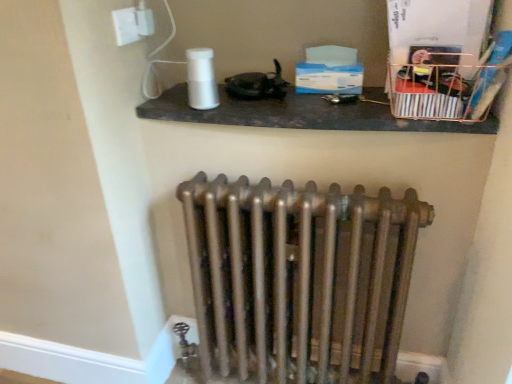
Question: Is white glossy shelf at upper center inside or outside of metallic wire basket at upper right?

Choices:
 (A) outside
 (B) inside

Answer: (A)

Question: In the image, is white glossy shelf at upper center on the left side or the right side of metallic wire basket at upper right?

Choices:
 (A) left
 (B) right

Answer: (A)

Question: Estimate the real-world distances between objects in this image. Which object is closer to the white glossy electric outlet at upper left?

Choices:
 (A) white glossy shelf at upper center
 (B) metallic wire basket at upper right
 (C) bronze metallic radiator at center

Answer: (A)

Question: Considering the real-world distances, which object is closest to the white glossy electric outlet at upper left?

Choices:
 (A) metallic wire basket at upper right
 (B) bronze metallic radiator at center
 (C) white glossy shelf at upper center

Answer: (C)